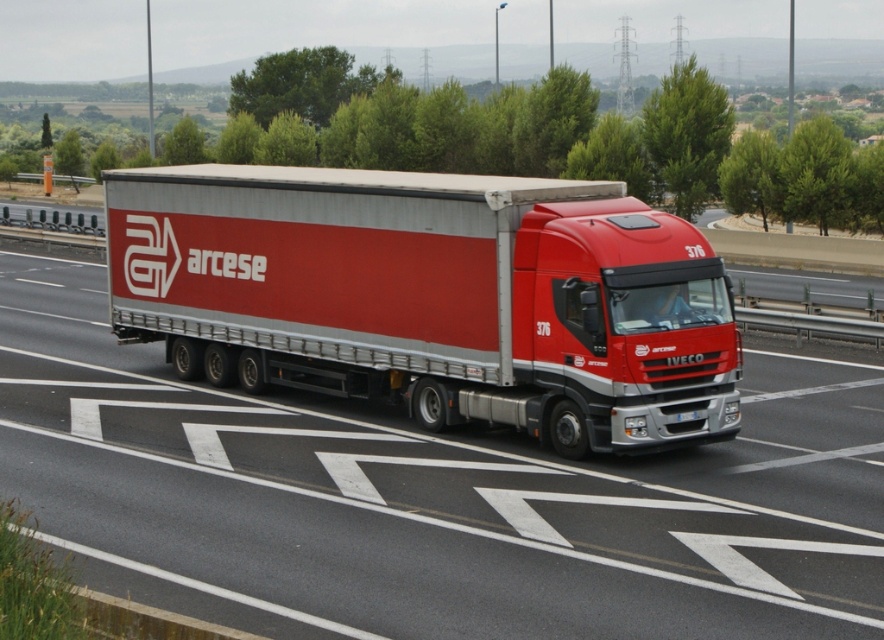
Based on the photo, is red matte truck at center closer to the viewer compared to metallic silver trailer at center?

Yes.

Identify the location of red matte truck at center. (431, 499).

Where is `red matte truck at center`? Image resolution: width=884 pixels, height=640 pixels. red matte truck at center is located at coordinates (431, 499).

Who is taller, red matte truck at center or white plastic license plate at center?

Standing taller between the two is red matte truck at center.

Which is in front, point (280, 534) or point (683, 360)?

Positioned in front is point (280, 534).

Find the location of `red matte truck at center`. red matte truck at center is located at coordinates (431, 499).

Does metallic silver trailer at center have a greater width compared to white plastic license plate at center?

Correct, the width of metallic silver trailer at center exceeds that of white plastic license plate at center.

Who is more forward, (325, 305) or (687, 362)?

Point (687, 362) is in front.

What are the coordinates of `metallic silver trailer at center` in the screenshot? It's located at (431, 296).